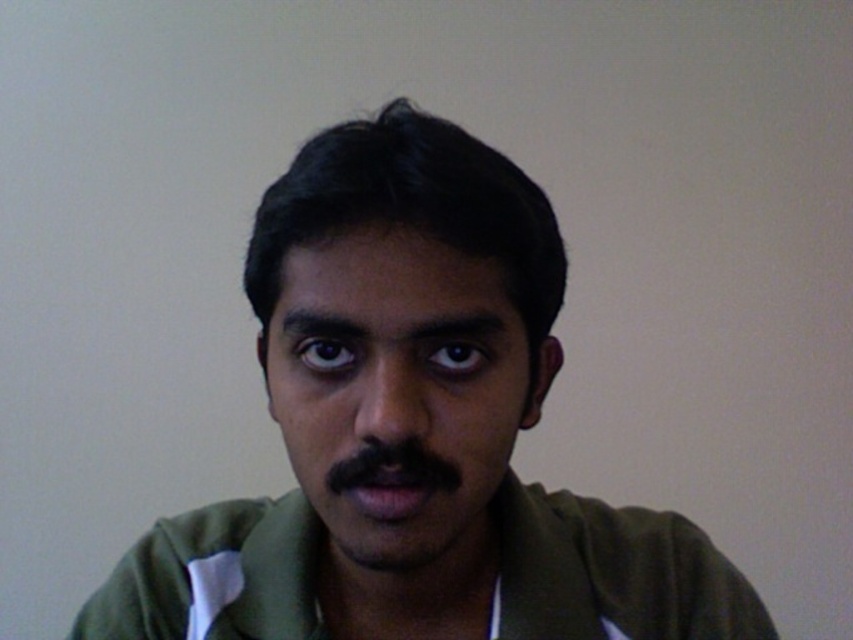
Question: Does green matte shirt at center appear over matte green face at center?

Choices:
 (A) yes
 (B) no

Answer: (A)

Question: Does green matte shirt at center have a larger size compared to matte green face at center?

Choices:
 (A) no
 (B) yes

Answer: (B)

Question: Which point is closer to the camera?

Choices:
 (A) matte green face at center
 (B) green matte shirt at center

Answer: (A)

Question: Is green matte shirt at center wider than matte green face at center?

Choices:
 (A) yes
 (B) no

Answer: (A)